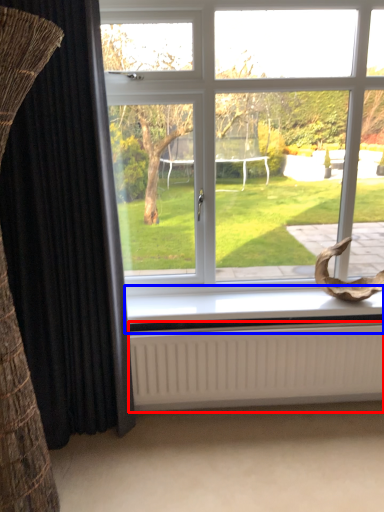
Question: Which object is further to the camera taking this photo, radiator (highlighted by a red box) or window sill (highlighted by a blue box)?

Choices:
 (A) radiator
 (B) window sill

Answer: (B)